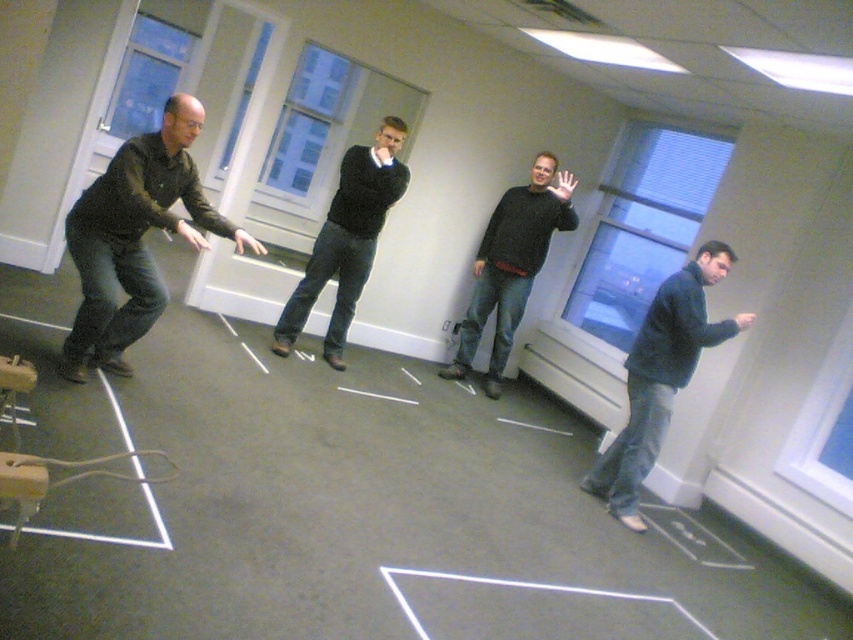
Question: Does dark blue jeans at lower right come behind dark gray sweater at center?

Choices:
 (A) yes
 (B) no

Answer: (B)

Question: Can you confirm if dark green sweater at left is positioned to the right of black sweater at center?

Choices:
 (A) no
 (B) yes

Answer: (A)

Question: Among these points, which one is farthest from the camera?

Choices:
 (A) (102, 304)
 (B) (520, 276)
 (C) (648, 436)

Answer: (B)

Question: Can you confirm if dark green sweater at left is smaller than dark blue jeans at lower right?

Choices:
 (A) yes
 (B) no

Answer: (B)

Question: Which point is farther to the camera?

Choices:
 (A) dark gray sweater at center
 (B) black sweater at center

Answer: (A)

Question: Which point is farther from the camera taking this photo?

Choices:
 (A) (515, 296)
 (B) (683, 321)
 (C) (138, 333)

Answer: (A)